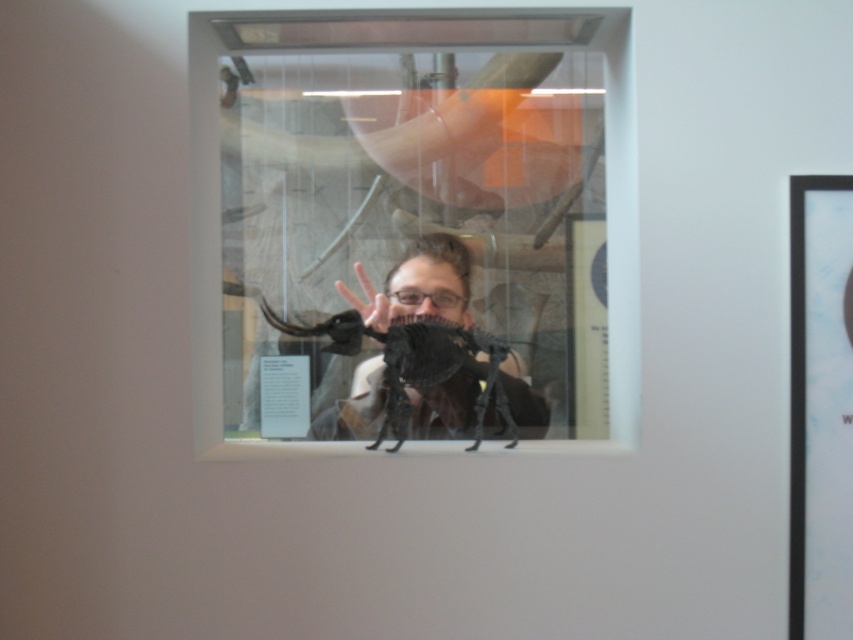
Is black matte mirror at center thinner than matte black hand at center?

Incorrect, black matte mirror at center's width is not less than matte black hand at center's.

Who is more forward, (321, 68) or (350, 298)?

Point (350, 298)

Locate an element on the screen. black matte mirror at center is located at coordinates (418, 236).

Find the location of `black matte mirror at center`. black matte mirror at center is located at coordinates (418, 236).

How far apart are black matte spider at center and matte black hand at center?

12.95 inches

Which is more to the left, black matte spider at center or matte black hand at center?

From the viewer's perspective, matte black hand at center appears more on the left side.

Who is more distant from viewer, [317,330] or [347,296]?

Point [347,296]

This screenshot has width=853, height=640. I want to click on black matte spider at center, so click(x=416, y=364).

Based on the photo, does black matte mirror at center appear on the right side of black matte spider at center?

No, black matte mirror at center is not to the right of black matte spider at center.

Measure the distance between black matte mirror at center and camera.

black matte mirror at center and camera are 5.25 feet apart.

At what (x,y) coordinates should I click in order to perform the action: click on black matte mirror at center. Please return your answer as a coordinate pair (x, y). Image resolution: width=853 pixels, height=640 pixels. Looking at the image, I should click on (418, 236).